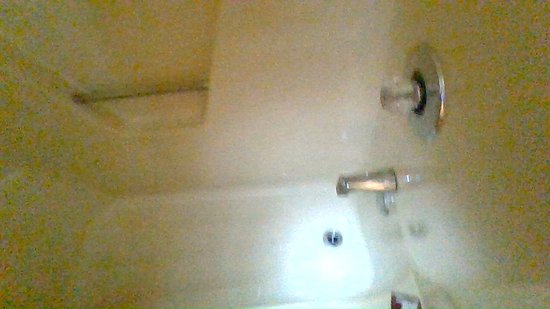
Identify the location of round steel under faucet. (390, 206).